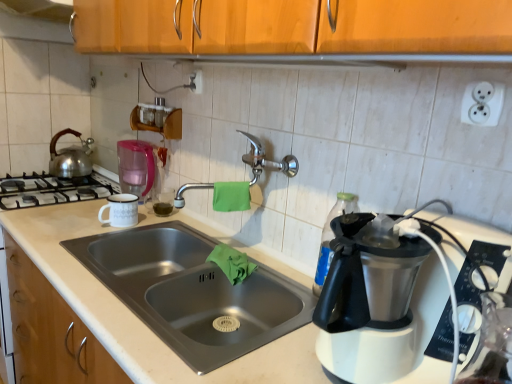
Question: Considering their positions, is silver metallic kettle at left located in front of or behind green cloth at sink, which is the 2th material from top to bottom?

Choices:
 (A) front
 (B) behind

Answer: (B)

Question: Choose the correct answer: Is silver metallic kettle at left inside green cloth at sink, which is the 2th material from top to bottom, or outside it?

Choices:
 (A) outside
 (B) inside

Answer: (A)

Question: Considering the real-world distances, which object is farthest from the white plastic electric outlet at upper right?

Choices:
 (A) green cloth at sink, which is the 2th material from top to bottom
 (B) pink plastic blender at left
 (C) transparent plastic bottle at right
 (D) green fabric towel at center, acting as the 1th material starting from the top
 (E) green matte liquid at sink

Answer: (B)

Question: Which object is positioned farthest from the satin nickel faucet at center?

Choices:
 (A) green cloth at sink, which ranks as the first material in bottom-to-top order
 (B) pink plastic blender at left
 (C) white enamel mug at left
 (D) white plastic electric outlet at upper right
 (E) green fabric towel at center, which is the 2th material from bottom to top

Answer: (D)